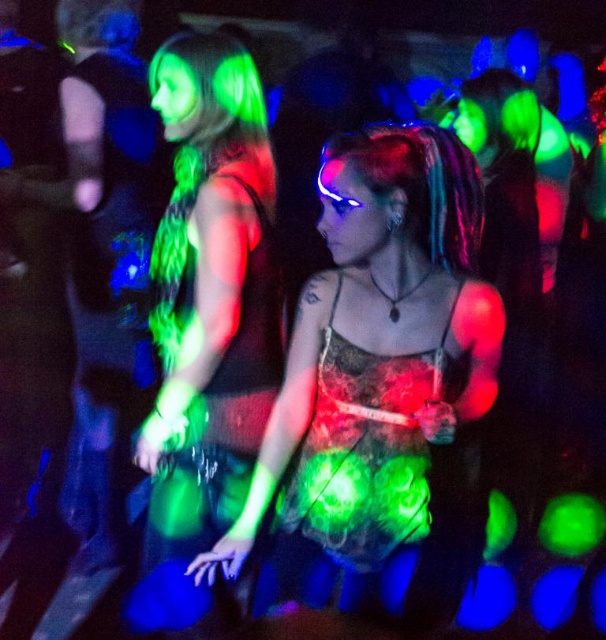
You are a photographer at the event and want to capture a photo where both the translucent lace top at center and the green fluorescent dress at left are visible. Given their sizes, which one should you focus on to ensure both fit in the frame?

The translucent lace top at center is wider than the green fluorescent dress at left, so focusing on the translucent lace top at center will ensure both fit in the frame.

You are a photographer at the event and want to capture both the translucent lace top at center and the green fluorescent dress at left in a single shot without moving the camera. Given that your camera has a minimum focus distance of 14 inches, will you be able to achieve this?

The distance between the translucent lace top at center and the green fluorescent dress at left is 13.95 inches, which is slightly less than the camera minimum focus distance of 14 inches. Therefore, you will not be able to capture both in a single shot without moving the camera.

You are a photographer at the party and want to capture both the translucent lace top at center and the green fluorescent dress at left in a single shot. Which object should you focus on first to ensure both are in frame?

The translucent lace top at center is located above the green fluorescent dress at left, so you should focus on the translucent lace top at center first to ensure both are in frame.